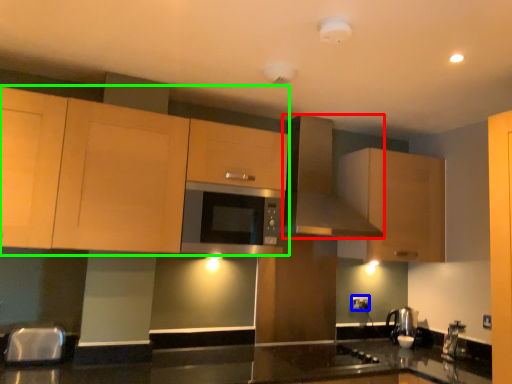
Question: Estimate the real-world distances between objects in this image. Which object is farther from kitchen appliance (highlighted by a red box), electric outlet (highlighted by a blue box) or cabinetry (highlighted by a green box)?

Choices:
 (A) electric outlet
 (B) cabinetry

Answer: (A)